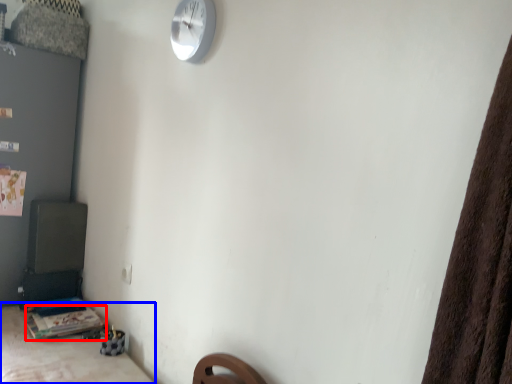
Question: Which object appears closest to the camera in this image, table (highlighted by a red box) or furniture (highlighted by a blue box)?

Choices:
 (A) table
 (B) furniture

Answer: (B)